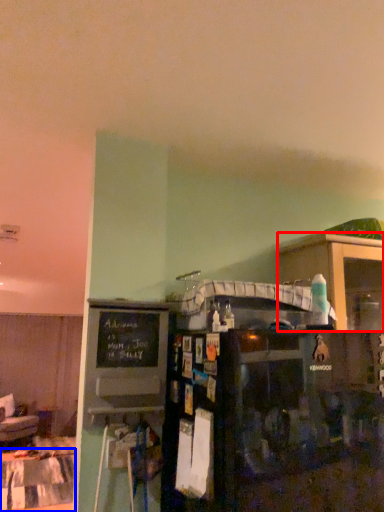
Question: Among these objects, which one is farthest to the camera, shelf (highlighted by a red box) or table (highlighted by a blue box)?

Choices:
 (A) shelf
 (B) table

Answer: (B)